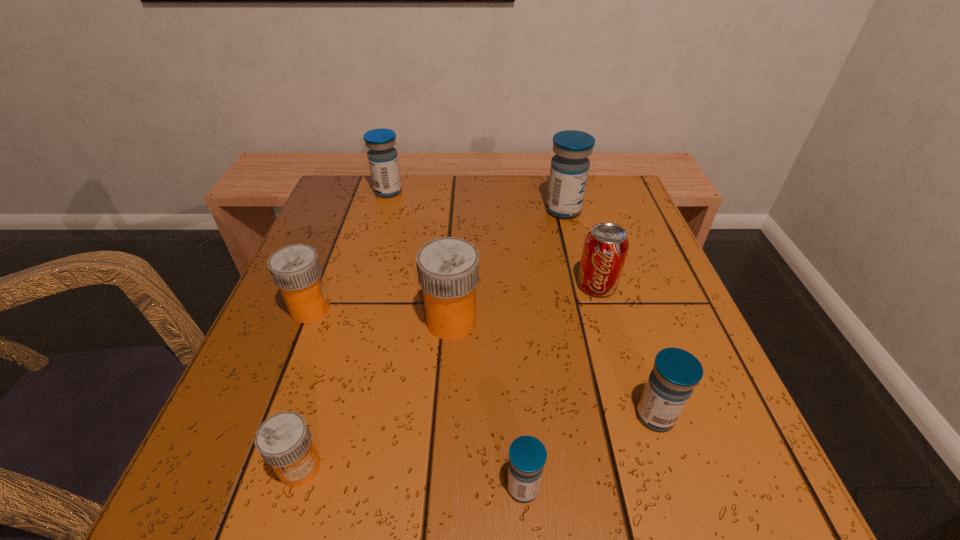
Locate an element on the screen. the tallest object is located at coordinates [x=569, y=169].

Identify the location of the second farthest blue medicine. (569, 169).

You are a GUI agent. You are given a task and a screenshot of the screen. Output one action in this format:
    pyautogui.click(x=<x>, y=<y>)
    Task: Click on the leftmost blue medicine
    This screenshot has width=960, height=540.
    Given the screenshot: What is the action you would take?
    383,161

Where is `the farthest blue medicine`? The height and width of the screenshot is (540, 960). the farthest blue medicine is located at coordinates (383, 161).

Locate an element on the screen. the fourth medicine from right to left is located at coordinates (448, 268).

In order to click on the rightmost orange medicine in this screenshot , I will do `click(448, 268)`.

This screenshot has width=960, height=540. Find the location of `soda can`. soda can is located at coordinates (605, 248).

Where is `the leftmost orange medicine`? This screenshot has height=540, width=960. the leftmost orange medicine is located at coordinates (295, 269).

You are a GUI agent. You are given a task and a screenshot of the screen. Output one action in this format:
    pyautogui.click(x=<x>, y=<y>)
    Task: Click on the leftmost medicine
    
    Given the screenshot: What is the action you would take?
    pyautogui.click(x=295, y=269)

Where is `the second nearest blue medicine`? Image resolution: width=960 pixels, height=540 pixels. the second nearest blue medicine is located at coordinates (676, 372).